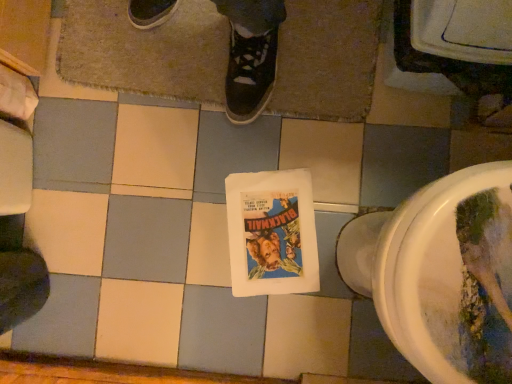
Image resolution: width=512 pixels, height=384 pixels. What are the coordinates of `vacant space to the left of brown textured bath mat at upper center` in the screenshot? It's located at (106, 183).